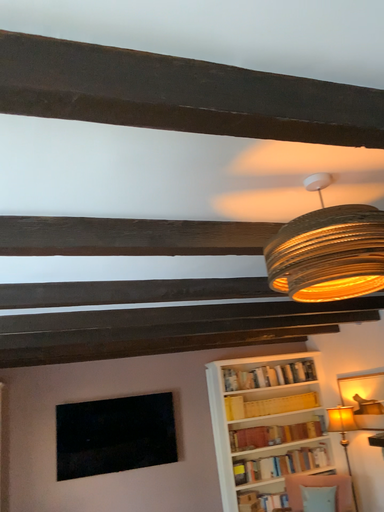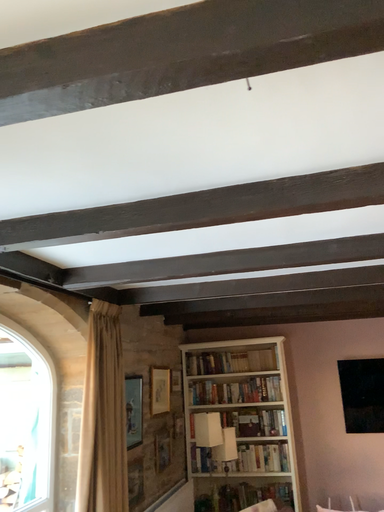
Question: How did the camera likely rotate when shooting the video?

Choices:
 (A) rotated upward
 (B) rotated downward

Answer: (B)